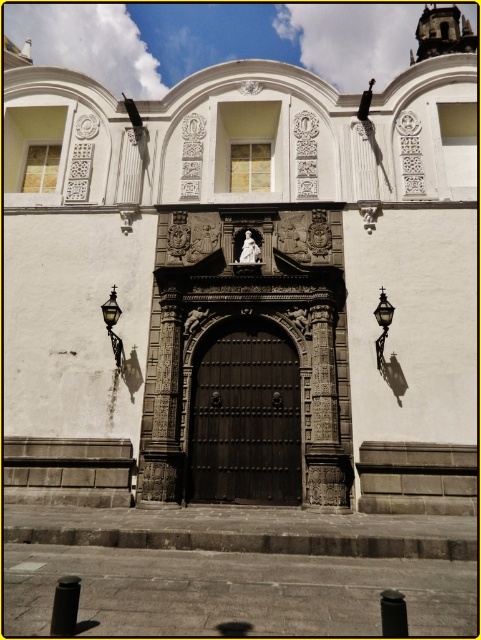
Question: Is dark wood door at center wider than bronze textured streetlamp at left?

Choices:
 (A) no
 (B) yes

Answer: (A)

Question: Which of the following is the farthest from the observer?

Choices:
 (A) dark wood door at center
 (B) bronze textured streetlamp at left

Answer: (A)

Question: In this image, where is bronze textured streetlamp at left located relative to matte black lantern at right?

Choices:
 (A) below
 (B) above

Answer: (B)

Question: Does dark wood door at center appear on the right side of bronze textured streetlamp at left?

Choices:
 (A) no
 (B) yes

Answer: (B)

Question: Which object appears closest to the camera in this image?

Choices:
 (A) matte black lantern at right
 (B) bronze textured streetlamp at left

Answer: (A)

Question: Among these points, which one is nearest to the camera?

Choices:
 (A) (376, 317)
 (B) (285, 500)

Answer: (B)